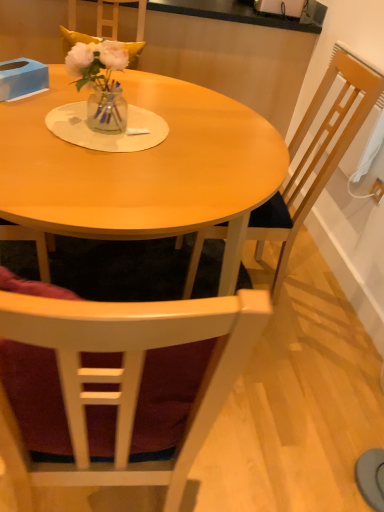
Where is `free spot in front of translucent glass vase at center`? free spot in front of translucent glass vase at center is located at coordinates (85, 147).